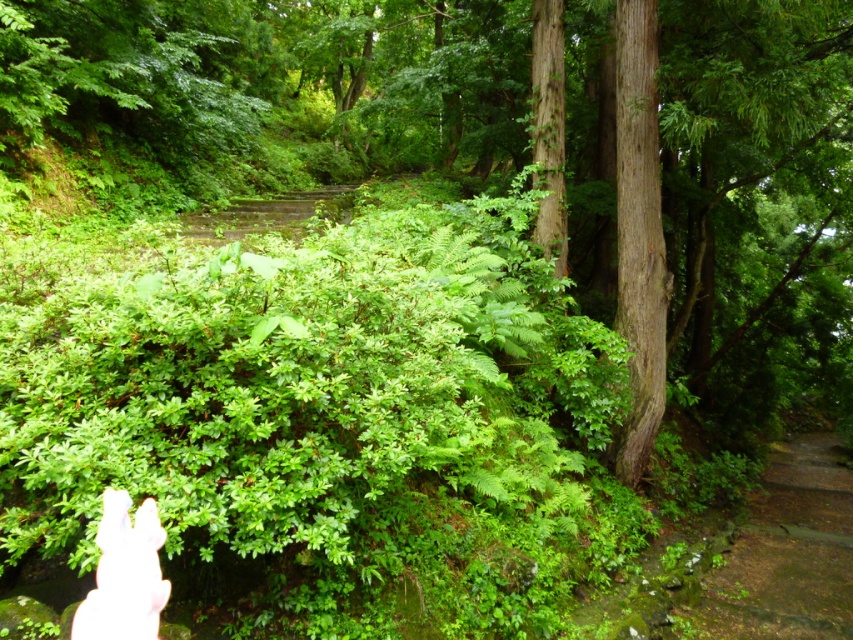
Question: Is brown dirt stairs at lower right bigger than white flesh at lower left?

Choices:
 (A) no
 (B) yes

Answer: (B)

Question: Among these objects, which one is farthest from the camera?

Choices:
 (A) smooth brown tree trunk at right
 (B) brown dirt stairs at lower right
 (C) white flesh at lower left

Answer: (A)

Question: Does smooth brown tree trunk at right come behind white flesh at lower left?

Choices:
 (A) no
 (B) yes

Answer: (B)

Question: Considering the real-world distances, which object is closest to the smooth brown tree trunk at right?

Choices:
 (A) white flesh at lower left
 (B) brown dirt stairs at lower right

Answer: (B)

Question: Which point is farther to the camera?

Choices:
 (A) smooth brown tree trunk at right
 (B) white flesh at lower left

Answer: (A)

Question: Where is brown dirt stairs at lower right located in relation to white flesh at lower left in the image?

Choices:
 (A) right
 (B) left

Answer: (A)